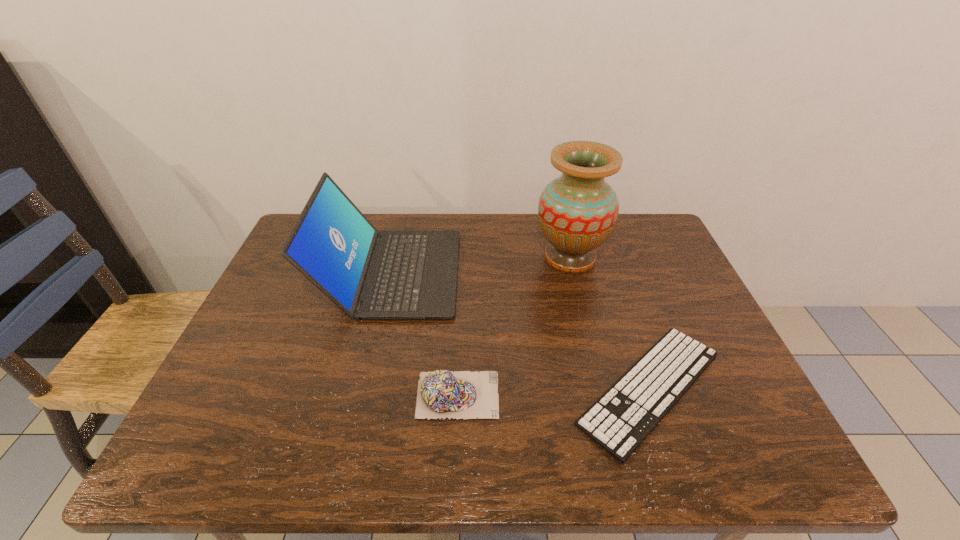
Where is `the tallest object`? The width and height of the screenshot is (960, 540). the tallest object is located at coordinates (577, 212).

What are the coordinates of `laptop computer` in the screenshot? It's located at (368, 274).

The image size is (960, 540). I want to click on cap, so click(x=441, y=393).

This screenshot has width=960, height=540. I want to click on the shortest object, so click(619, 421).

This screenshot has height=540, width=960. What are the coordinates of `vacant space located on the left of the vase` in the screenshot? It's located at (496, 258).

At what (x,y) coordinates should I click in order to perform the action: click on free space located on the screen of the second tallest object. Please return your answer as a coordinate pair (x, y). This screenshot has height=540, width=960. Looking at the image, I should click on (510, 273).

The image size is (960, 540). In order to click on vacant position located 0.220m on the front, side, and top of the second shortest object in this screenshot , I will do `click(600, 395)`.

This screenshot has width=960, height=540. Find the location of `vacant region located on the left of the computer keyboard`. vacant region located on the left of the computer keyboard is located at coordinates (413, 388).

Where is `vase at the far edge`? The width and height of the screenshot is (960, 540). vase at the far edge is located at coordinates (577, 212).

The image size is (960, 540). I want to click on laptop computer at the far edge, so click(368, 274).